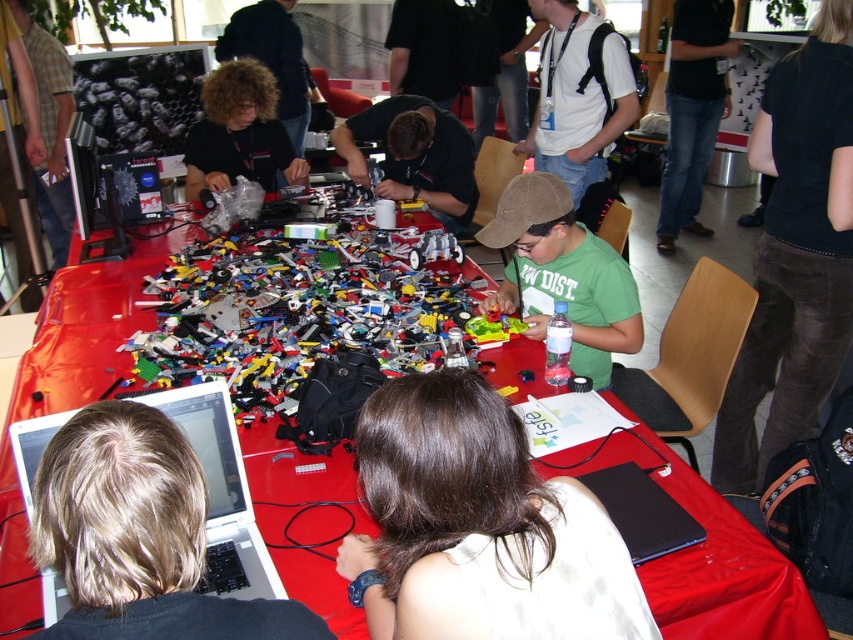
Where is the green matte shirt at center located in the image?

The green matte shirt at center is located at point (561,275) in the image.

You are standing at the point labeled point (228, 518) in the image. Looking towards the large red table, can you see the point labeled point (531, 252)?

No, because point (531, 252) is behind point (228, 518), so it would be obstructed from your view.